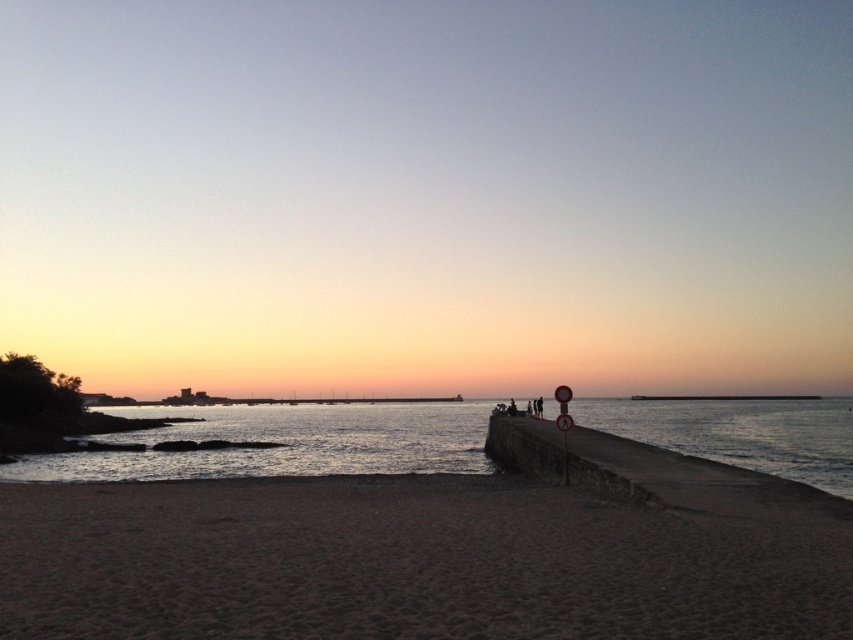
Consider the image. Who is shorter, dark brown sand at lower center or silvery reflective water at lower left?

Standing shorter between the two is dark brown sand at lower center.

Is dark brown sand at lower center wider than silvery reflective water at lower left?

No, dark brown sand at lower center is not wider than silvery reflective water at lower left.

Does point (91, 618) come in front of point (280, 436)?

Yes.

You are a GUI agent. You are given a task and a screenshot of the screen. Output one action in this format:
    pyautogui.click(x=<x>, y=<y>)
    Task: Click on the dark brown sand at lower center
    The image size is (853, 640).
    Given the screenshot: What is the action you would take?
    pyautogui.click(x=405, y=563)